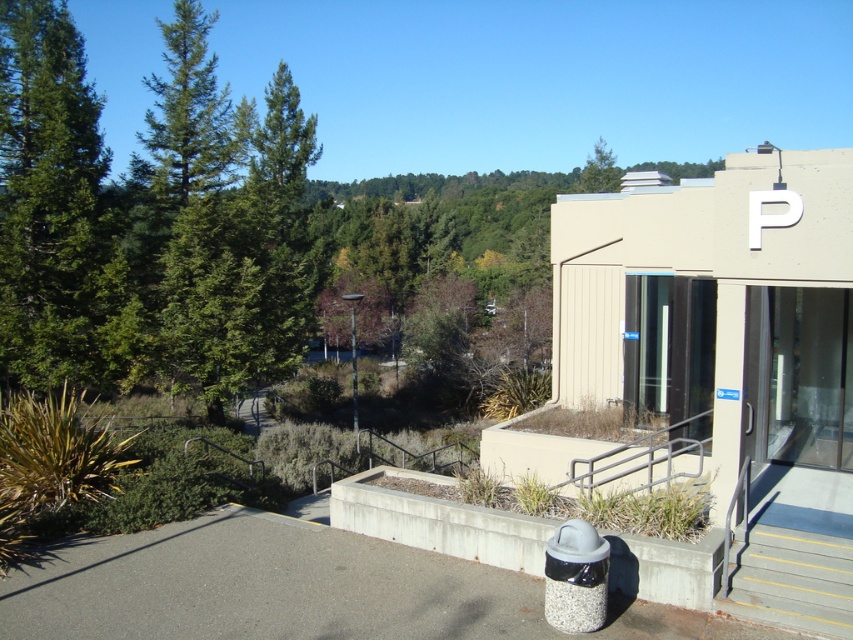
Is green matte tree at left in front of gray/steps at lower right?

That is False.

Can you confirm if green matte tree at left is wider than gray/steps at lower right?

Indeed, green matte tree at left has a greater width compared to gray/steps at lower right.

Between point (35, 67) and point (721, 600), which one is positioned in front?

Positioned in front is point (721, 600).

The width and height of the screenshot is (853, 640). What are the coordinates of `green matte tree at left` in the screenshot? It's located at (56, 212).